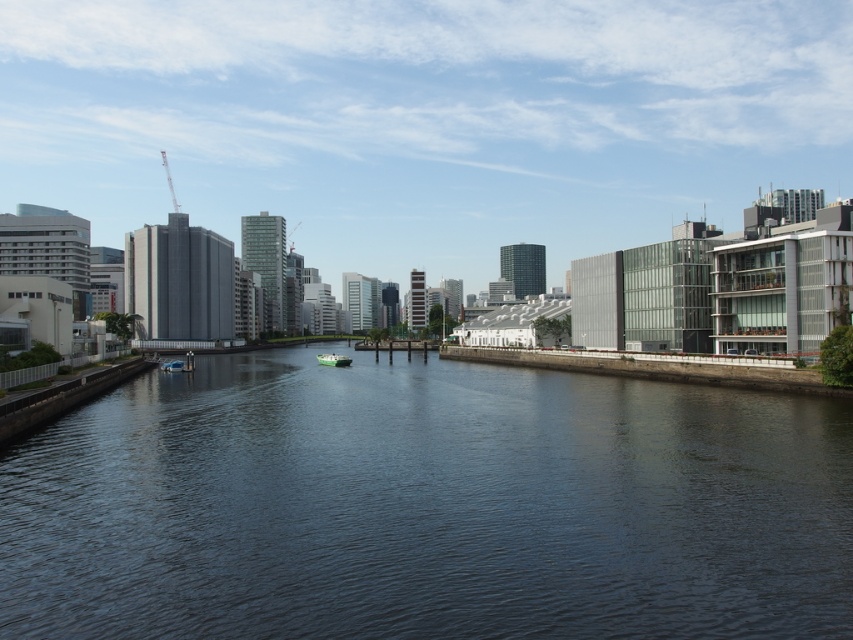
Is dark blue water at center below blue glossy boat at center?

Correct, dark blue water at center is located below blue glossy boat at center.

This screenshot has width=853, height=640. In order to click on dark blue water at center in this screenshot , I will do `click(427, 506)`.

I want to click on dark blue water at center, so click(427, 506).

Is green matte boat at center to the right of blue glossy boat at center from the viewer's perspective?

Correct, you'll find green matte boat at center to the right of blue glossy boat at center.

Does green matte boat at center come behind blue glossy boat at center?

Yes, green matte boat at center is further from the viewer.

Consider the image. Who is more distant from viewer, (318,356) or (183,369)?

The point (318,356) is behind.

I want to click on green matte boat at center, so click(x=334, y=358).

Which is above, dark blue water at center or green matte boat at center?

Positioned higher is green matte boat at center.

Does dark blue water at center have a greater width compared to green matte boat at center?

Indeed, dark blue water at center has a greater width compared to green matte boat at center.

Which is in front, point (195, 381) or point (328, 356)?

Point (195, 381)

Where is `dark blue water at center`? The height and width of the screenshot is (640, 853). dark blue water at center is located at coordinates (427, 506).